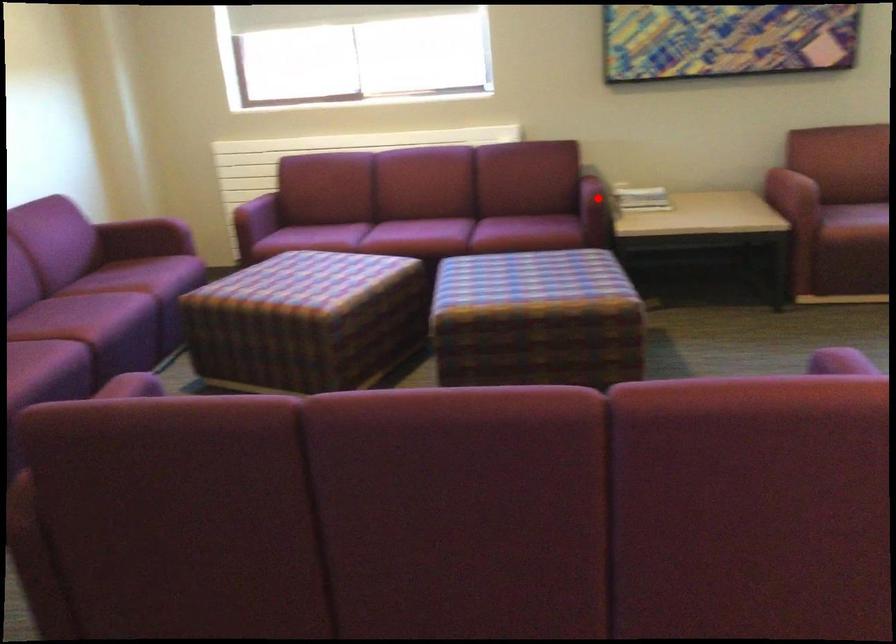
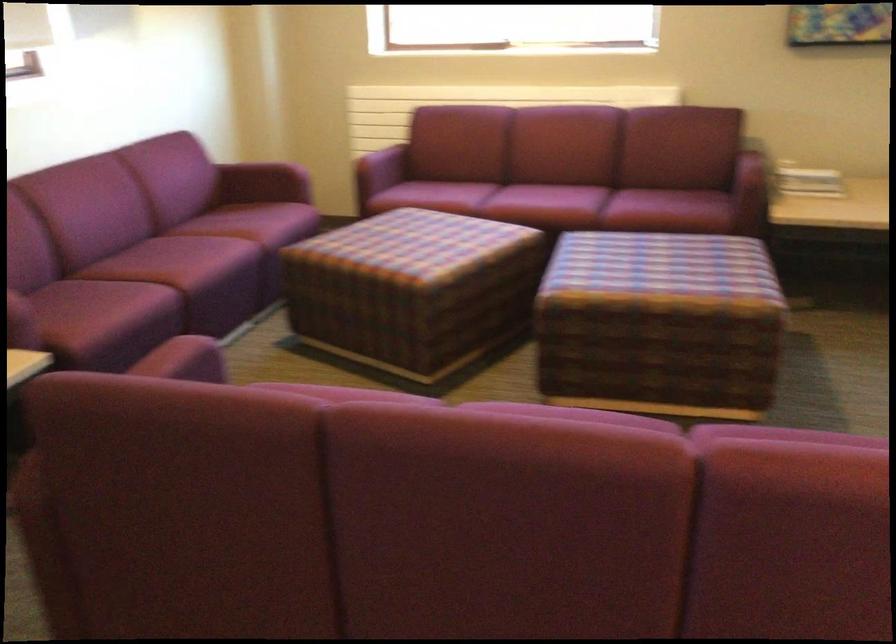
Question: I am providing you with two images of the same scene from different viewpoints. Given a red point in image1, look at the same physical point in image2. Is it:

Choices:
 (A) Closer to the viewpoint
 (B) Farther from the viewpoint

Answer: (A)